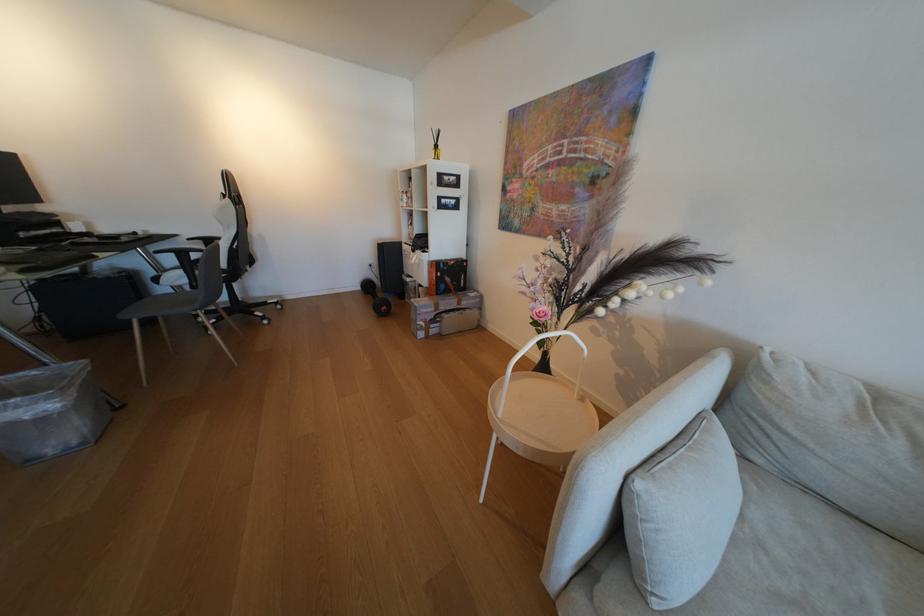
Image resolution: width=924 pixels, height=616 pixels. Identify the location of white table handle. (561, 347).